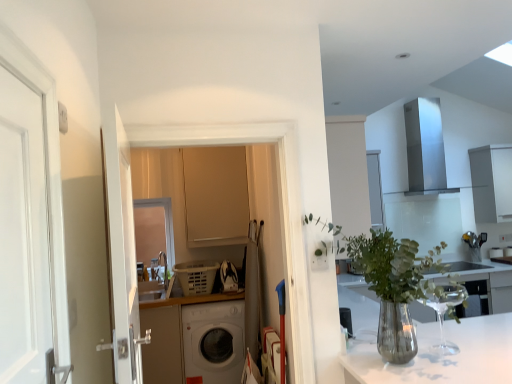
Question: Is white glossy sink at center outside matte beige cabinet at center, marked as the 2th cabinetry in a right-to-left arrangement?

Choices:
 (A) no
 (B) yes

Answer: (B)

Question: Is there a large distance between white glossy sink at center and matte beige cabinet at center, the first cabinetry in the front-to-back sequence?

Choices:
 (A) no
 (B) yes

Answer: (B)

Question: Does white glossy sink at center have a greater height compared to matte beige cabinet at center, which is the second cabinetry from back to front?

Choices:
 (A) no
 (B) yes

Answer: (A)

Question: Is white glossy sink at center thinner than matte beige cabinet at center, which is counted as the first cabinetry, starting from the left?

Choices:
 (A) yes
 (B) no

Answer: (B)

Question: Does white glossy sink at center turn towards matte beige cabinet at center, marked as the 2th cabinetry in a right-to-left arrangement?

Choices:
 (A) no
 (B) yes

Answer: (A)

Question: Considering the positions of matte beige cabinet at center, the first cabinetry in the front-to-back sequence, and white matte cabinet at upper right, which is counted as the 1th cabinetry, starting from the back, in the image, is matte beige cabinet at center, the first cabinetry in the front-to-back sequence, wider or thinner than white matte cabinet at upper right, which is counted as the 1th cabinetry, starting from the back,?

Choices:
 (A) thin
 (B) wide

Answer: (A)

Question: Is matte beige cabinet at center, marked as the 2th cabinetry in a right-to-left arrangement, bigger or smaller than white matte cabinet at upper right, which is the first cabinetry from right to left?

Choices:
 (A) big
 (B) small

Answer: (B)

Question: Do you think matte beige cabinet at center, which is counted as the first cabinetry, starting from the left, is within white matte cabinet at upper right, which is the first cabinetry from right to left, or outside of it?

Choices:
 (A) inside
 (B) outside

Answer: (B)

Question: Is point (216, 218) closer or farther from the camera than point (500, 200)?

Choices:
 (A) farther
 (B) closer

Answer: (B)

Question: Is white matte washing machine at center wider or thinner than translucent glass vase at center?

Choices:
 (A) wide
 (B) thin

Answer: (A)

Question: From a real-world perspective, is white matte washing machine at center positioned above or below translucent glass vase at center?

Choices:
 (A) above
 (B) below

Answer: (B)

Question: Considering the positions of white matte washing machine at center and translucent glass vase at center in the image, is white matte washing machine at center taller or shorter than translucent glass vase at center?

Choices:
 (A) short
 (B) tall

Answer: (B)

Question: Would you say white matte washing machine at center is to the left or to the right of translucent glass vase at center in the picture?

Choices:
 (A) right
 (B) left

Answer: (B)

Question: From the image's perspective, relative to white glossy sink at center, is matte beige cabinet at center, marked as the 2th cabinetry in a right-to-left arrangement, above or below?

Choices:
 (A) above
 (B) below

Answer: (A)

Question: Considering the positions of matte beige cabinet at center, which is the second cabinetry from back to front, and white glossy sink at center in the image, is matte beige cabinet at center, which is the second cabinetry from back to front, wider or thinner than white glossy sink at center?

Choices:
 (A) wide
 (B) thin

Answer: (B)